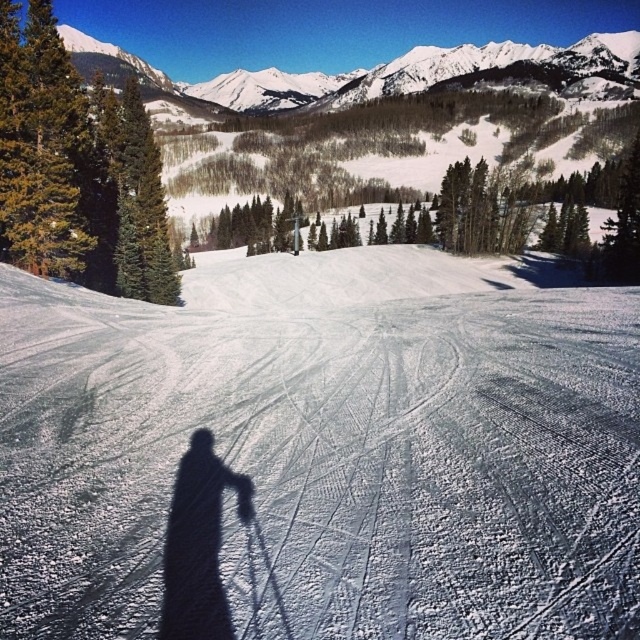
Between point (32, 320) and point (195, 451), which one is positioned in front?

Point (195, 451)

This screenshot has width=640, height=640. What do you see at coordinates (323, 451) in the screenshot?
I see `white snow at center` at bounding box center [323, 451].

Identify the location of white snow at center. 323,451.